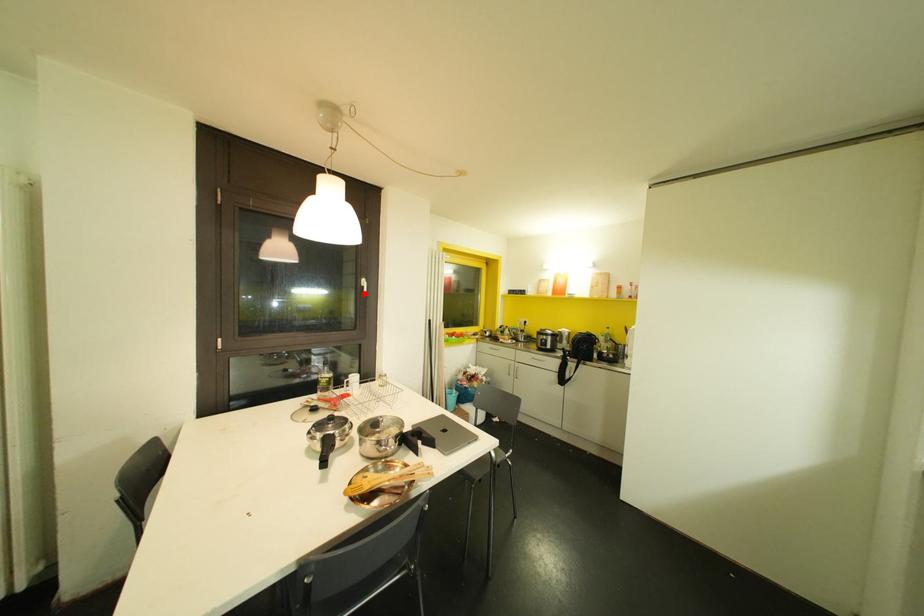
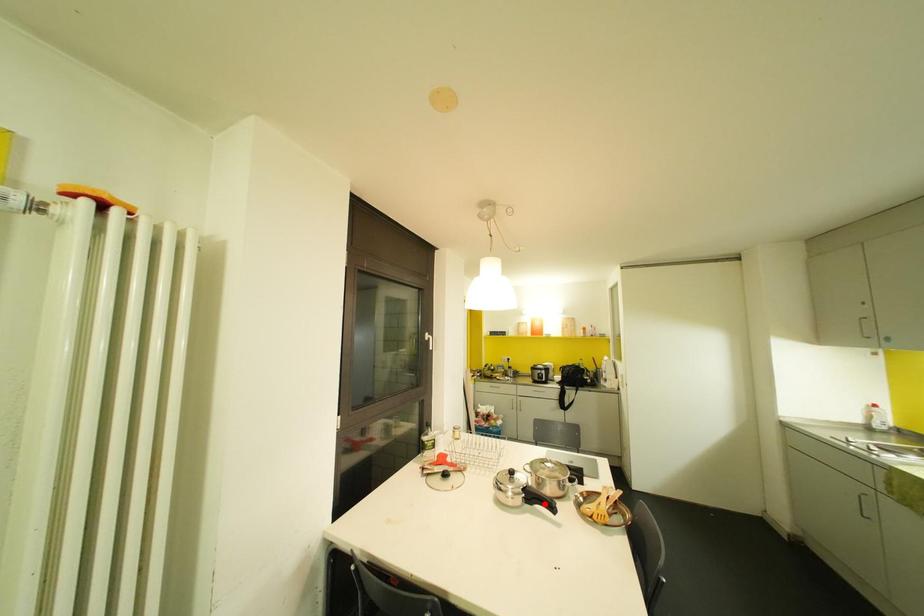
I am providing you with two images of the same scene from different viewpoints. A red point is marked on the first image and another point is marked on the second image. Are the points marked in image1 and image2 representing the same 3D position?

No